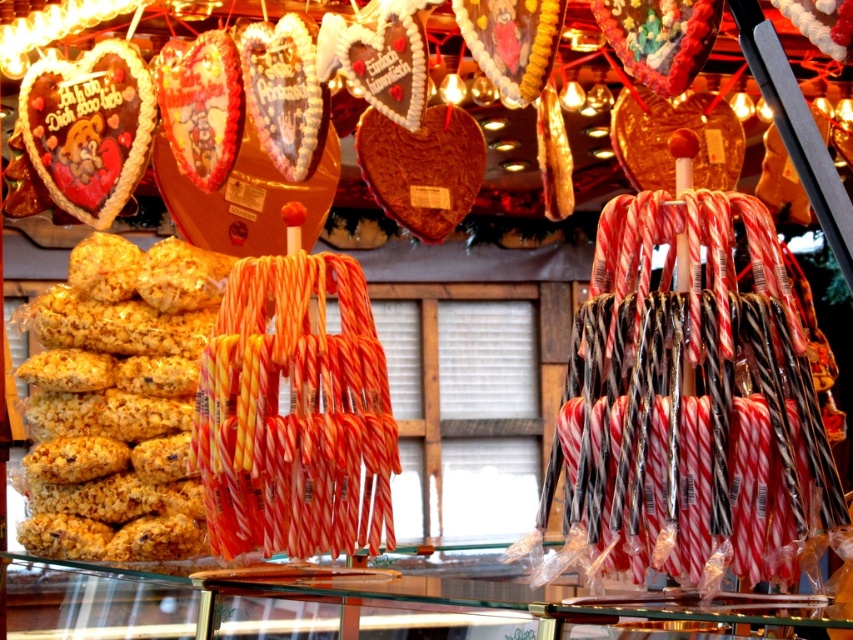
Which is in front, point (115, 296) or point (96, 184)?

Point (96, 184) is more forward.

Describe the element at coordinates (119, 401) in the screenshot. The image size is (853, 640). I see `crispy yellow popcorn at left` at that location.

Where is `crispy yellow popcorn at left`? The width and height of the screenshot is (853, 640). crispy yellow popcorn at left is located at coordinates (119, 401).